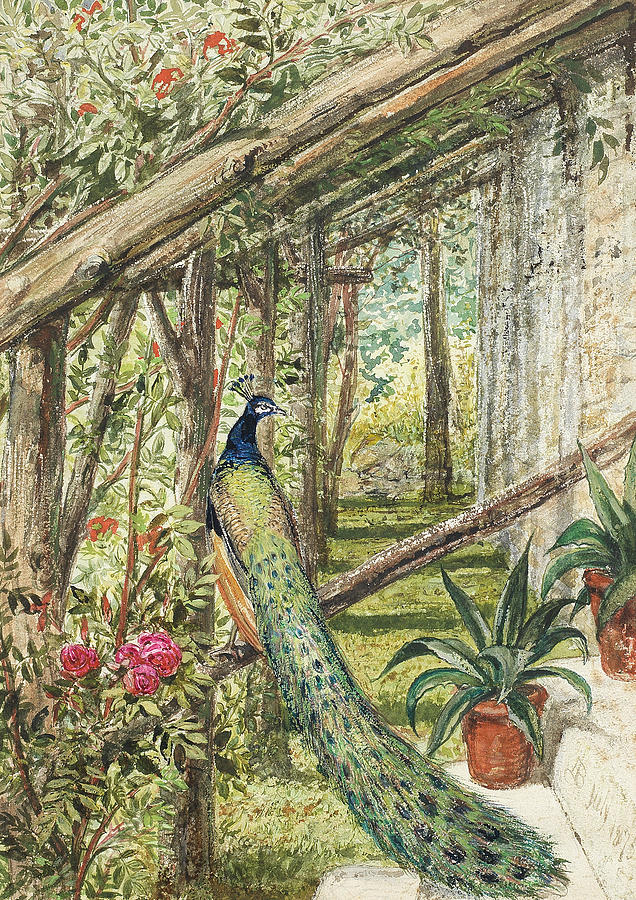
Image resolution: width=636 pixels, height=900 pixels. In order to click on succulent in this screenshot , I will do click(x=495, y=648), click(x=619, y=536).